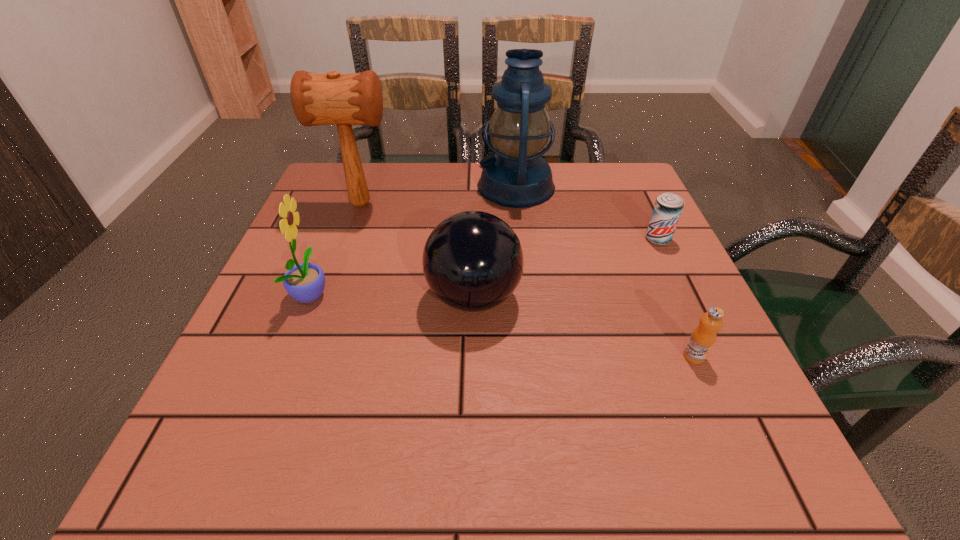
The image size is (960, 540). What are the coordinates of `object at the far left corner` in the screenshot? It's located at (317, 99).

Find the location of a particular element. vacant region at the far edge of the desktop is located at coordinates (496, 212).

Image resolution: width=960 pixels, height=540 pixels. In the image, there is a desktop. Identify the location of free region at the near edge. (589, 450).

This screenshot has width=960, height=540. Find the location of `vacant space at the left edge of the desktop`. vacant space at the left edge of the desktop is located at coordinates (308, 422).

Where is `vacant space at the right edge of the desktop`? vacant space at the right edge of the desktop is located at coordinates (650, 301).

Locate an element on the screen. This screenshot has width=960, height=540. vacant space at the far left corner of the desktop is located at coordinates (366, 207).

Locate an element on the screen. The width and height of the screenshot is (960, 540). free region at the near left corner of the desktop is located at coordinates (233, 458).

At what (x,y) coordinates should I click in order to perform the action: click on free region at the far right corner of the desktop. Please return your answer as a coordinate pair (x, y). The height and width of the screenshot is (540, 960). Looking at the image, I should click on (637, 194).

Find the location of `vacant region at the near right corner`. vacant region at the near right corner is located at coordinates (745, 449).

This screenshot has height=540, width=960. I want to click on vacant area that lies between the sunflower and the nearest object, so click(x=502, y=325).